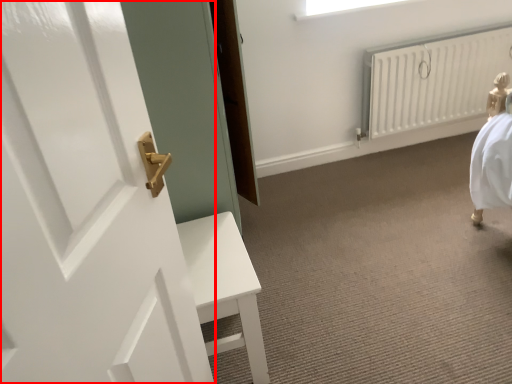
Question: In this image, where is door (annotated by the red box) located relative to radiator?

Choices:
 (A) right
 (B) left

Answer: (B)